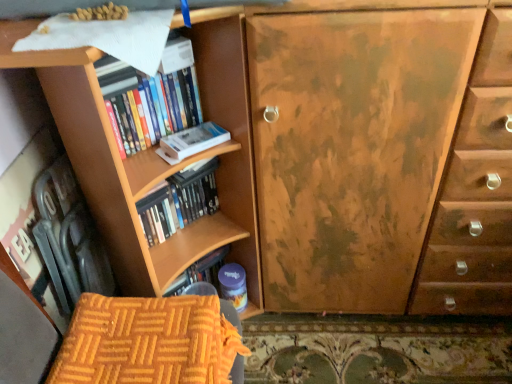
What do you see at coordinates (179, 201) in the screenshot? The height and width of the screenshot is (384, 512). I see `wooden bookshelf at center, the 2th book in the top-to-bottom sequence` at bounding box center [179, 201].

Identify the location of wooden bookshelf at center, which is the first book from bottom to top. Image resolution: width=512 pixels, height=384 pixels. (179, 201).

Is orange quilted fabric armchair at lower left smaller than hardcover books at left, which is the first book in top-to-bottom order?

Yes, orange quilted fabric armchair at lower left is smaller than hardcover books at left, which is the first book in top-to-bottom order.

From the picture: How distant is orange quilted fabric armchair at lower left from hardcover books at left, which is the first book in top-to-bottom order?

orange quilted fabric armchair at lower left is 18.58 inches from hardcover books at left, which is the first book in top-to-bottom order.

From the image's perspective, relative to hardcover books at left, which is the first book in top-to-bottom order, is orange quilted fabric armchair at lower left above or below?

orange quilted fabric armchair at lower left is situated lower than hardcover books at left, which is the first book in top-to-bottom order, in the image.

Does wooden bookshelf at center, the 2th book in the top-to-bottom sequence, have a lesser height compared to hardcover books at left, which is the first book in top-to-bottom order?

No.

Which object is thinner, wooden bookshelf at center, the 2th book in the top-to-bottom sequence, or hardcover books at left, which is the first book in top-to-bottom order?

hardcover books at left, which is the first book in top-to-bottom order, is thinner.

Identify the location of book above the wooden bookshelf at center, the 2th book in the top-to-bottom sequence (from a real-world perspective). The height and width of the screenshot is (384, 512). (152, 97).

Considering the relative sizes of white matte paperback book at upper left and wooden bookshelf at center, which is the first book from bottom to top, in the image provided, is white matte paperback book at upper left bigger than wooden bookshelf at center, which is the first book from bottom to top,?

No.

Is point (183, 146) farther from camera compared to point (170, 215)?

No, it is not.

Does white matte paperback book at upper left lie behind wooden bookshelf at center, the 2th book in the top-to-bottom sequence?

No, it is not.

Does white matte paperback book at upper left appear on the left side of wooden bookshelf at center, the 2th book in the top-to-bottom sequence?

No.

Can you confirm if hardcover books at left, which is the first book in top-to-bottom order, is shorter than wooden bookshelf at center, which is the first book from bottom to top?

Yes, hardcover books at left, which is the first book in top-to-bottom order, is shorter than wooden bookshelf at center, which is the first book from bottom to top.

Which of these two, hardcover books at left, positioned as the second book in bottom-to-top order, or wooden bookshelf at center, the 2th book in the top-to-bottom sequence, is wider?

wooden bookshelf at center, the 2th book in the top-to-bottom sequence, is wider.

Consider the image. From a real-world perspective, between hardcover books at left, which is the first book in top-to-bottom order, and wooden bookshelf at center, which is the first book from bottom to top, who is vertically higher?

hardcover books at left, which is the first book in top-to-bottom order, from a real-world perspective.

Considering the points (128, 113) and (215, 189), which point is behind, point (128, 113) or point (215, 189)?

The point (215, 189) is farther.

Is point (183, 150) less distant than point (134, 322)?

No, (183, 150) is further to viewer.

Can you confirm if white matte paperback book at upper left is taller than orange quilted fabric armchair at lower left?

In fact, white matte paperback book at upper left may be shorter than orange quilted fabric armchair at lower left.

Looking at this image, would you say white matte paperback book at upper left is inside or outside orange quilted fabric armchair at lower left?

white matte paperback book at upper left is located beyond the bounds of orange quilted fabric armchair at lower left.

Is wooden bookshelf at center, which is the first book from bottom to top, taller or shorter than orange quilted fabric armchair at lower left?

wooden bookshelf at center, which is the first book from bottom to top, is taller than orange quilted fabric armchair at lower left.

Which object is wider, wooden bookshelf at center, which is the first book from bottom to top, or orange quilted fabric armchair at lower left?

orange quilted fabric armchair at lower left is wider.

Does point (205, 162) come closer to viewer compared to point (97, 295)?

No, (205, 162) is further to viewer.

Between wooden bookshelf at center, the 2th book in the top-to-bottom sequence, and orange quilted fabric armchair at lower left, which one is positioned behind?

wooden bookshelf at center, the 2th book in the top-to-bottom sequence, is further away from the camera.

Would you say hardcover books at left, which is the first book in top-to-bottom order, is inside or outside white matte paperback book at upper left?

hardcover books at left, which is the first book in top-to-bottom order, is not enclosed by white matte paperback book at upper left.

Looking at the image, does hardcover books at left, which is the first book in top-to-bottom order, seem bigger or smaller compared to white matte paperback book at upper left?

Considering their sizes, hardcover books at left, which is the first book in top-to-bottom order, takes up more space than white matte paperback book at upper left.

Is the position of hardcover books at left, positioned as the second book in bottom-to-top order, more distant than that of white matte paperback book at upper left?

No, hardcover books at left, positioned as the second book in bottom-to-top order, is in front of white matte paperback book at upper left.

Can you tell me how much hardcover books at left, positioned as the second book in bottom-to-top order, and white matte paperback book at upper left differ in facing direction?

hardcover books at left, positioned as the second book in bottom-to-top order, and white matte paperback book at upper left are facing 3.24 degrees away from each other.

Locate an element on the screen. The width and height of the screenshot is (512, 384). book that is the 2nd one when counting leftward from the orange quilted fabric armchair at lower left is located at coordinates (152, 97).

At what (x,y) coordinates should I click in order to perform the action: click on book below the hardcover books at left, which is the first book in top-to-bottom order (from the image's perspective). Please return your answer as a coordinate pair (x, y). Image resolution: width=512 pixels, height=384 pixels. Looking at the image, I should click on (179, 201).

Which object lies further to the anchor point white matte paperback book at upper left, wooden bookshelf at center, which is the first book from bottom to top, or orange quilted fabric armchair at lower left?

Based on the image, orange quilted fabric armchair at lower left appears to be further to white matte paperback book at upper left.

From the image, which object appears to be nearer to orange quilted fabric armchair at lower left, wooden bookshelf at center, which is the first book from bottom to top, or white matte paperback book at upper left?

Among the two, wooden bookshelf at center, which is the first book from bottom to top, is located nearer to orange quilted fabric armchair at lower left.

Looking at the image, which one is located further to white matte paperback book at upper left, hardcover books at left, positioned as the second book in bottom-to-top order, or wooden bookshelf at center, which is the first book from bottom to top?

wooden bookshelf at center, which is the first book from bottom to top, is further to white matte paperback book at upper left.

Estimate the real-world distances between objects in this image. Which object is further from white matte paperback book at upper left, orange quilted fabric armchair at lower left or wooden bookshelf at center, which is the first book from bottom to top?

orange quilted fabric armchair at lower left is further to white matte paperback book at upper left.

When comparing their distances from orange quilted fabric armchair at lower left, does white matte paperback book at upper left or hardcover books at left, which is the first book in top-to-bottom order, seem further?

The object further to orange quilted fabric armchair at lower left is hardcover books at left, which is the first book in top-to-bottom order.

Looking at the image, which one is located further to hardcover books at left, which is the first book in top-to-bottom order, wooden bookshelf at center, which is the first book from bottom to top, or orange quilted fabric armchair at lower left?

orange quilted fabric armchair at lower left lies further to hardcover books at left, which is the first book in top-to-bottom order, than the other object.

Based on their spatial positions, is white matte paperback book at upper left or wooden bookshelf at center, which is the first book from bottom to top, further from orange quilted fabric armchair at lower left?

white matte paperback book at upper left lies further to orange quilted fabric armchair at lower left than the other object.

Which object lies nearer to the anchor point hardcover books at left, positioned as the second book in bottom-to-top order, orange quilted fabric armchair at lower left or wooden bookshelf at center, which is the first book from bottom to top?

Among the two, wooden bookshelf at center, which is the first book from bottom to top, is located nearer to hardcover books at left, positioned as the second book in bottom-to-top order.

Locate an element on the screen. book between white matte paperback book at upper left and orange quilted fabric armchair at lower left vertically is located at coordinates (179, 201).

The width and height of the screenshot is (512, 384). What are the coordinates of `paperback book between hardcover books at left, positioned as the second book in bottom-to-top order, and wooden bookshelf at center, which is the first book from bottom to top, in the up-down direction` in the screenshot? It's located at (192, 141).

I want to click on paperback book between hardcover books at left, which is the first book in top-to-bottom order, and orange quilted fabric armchair at lower left in the up-down direction, so click(x=192, y=141).

The image size is (512, 384). Identify the location of book between hardcover books at left, which is the first book in top-to-bottom order, and orange quilted fabric armchair at lower left, in the vertical direction. (179, 201).